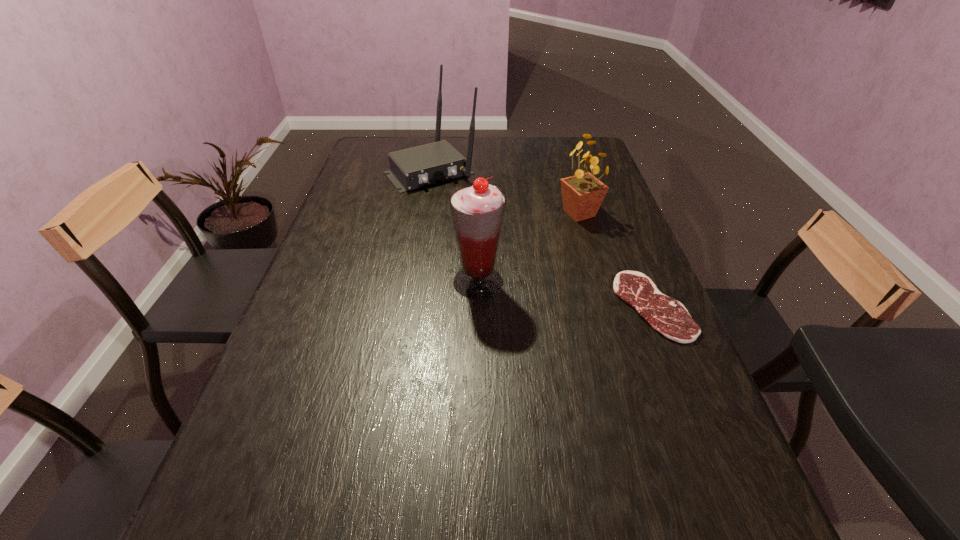
Locate an element on the screen. The height and width of the screenshot is (540, 960). vacant area that lies between the steak and the router is located at coordinates (541, 239).

This screenshot has width=960, height=540. Find the location of `vacant area that lies between the third nearest object and the farthest object`. vacant area that lies between the third nearest object and the farthest object is located at coordinates (505, 192).

Find the location of a particular element. This screenshot has height=540, width=960. free space between the farthest object and the third nearest object is located at coordinates (505, 192).

The image size is (960, 540). I want to click on object that stands as the second closest to the shortest object, so click(477, 209).

Where is `object that is the third closest to the steak`? This screenshot has height=540, width=960. object that is the third closest to the steak is located at coordinates (416, 167).

This screenshot has width=960, height=540. What are the coordinates of `vacant area in the image that satisfies the following two spatial constraints: 1. on the front side of the router; 2. on the right side of the shortest object` in the screenshot? It's located at (408, 306).

At what (x,y) coordinates should I click in order to perform the action: click on vacant space that satisfies the following two spatial constraints: 1. on the front side of the farthest object; 2. on the right side of the shortest object. Please return your answer as a coordinate pair (x, y). This screenshot has height=540, width=960. Looking at the image, I should click on (408, 306).

You are a GUI agent. You are given a task and a screenshot of the screen. Output one action in this format:
    pyautogui.click(x=<x>, y=<y>)
    Task: Click on the free space in the image that satisfies the following two spatial constraints: 1. on the front side of the steak; 2. on the left side of the smoothie
    The width and height of the screenshot is (960, 540).
    Given the screenshot: What is the action you would take?
    pyautogui.click(x=478, y=306)